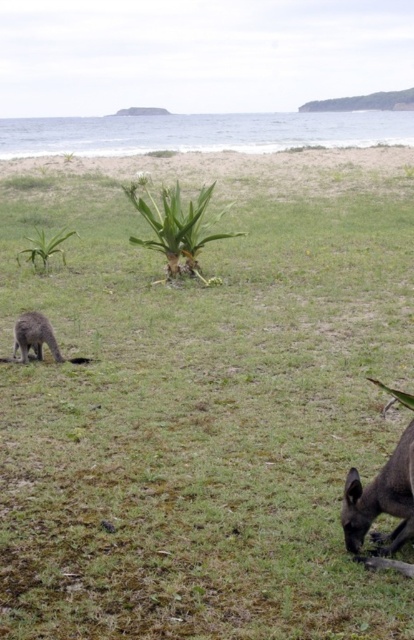
Question: From the image, what is the correct spatial relationship of brown furry kangaroo at lower right in relation to brown fur kangaroo at lower left?

Choices:
 (A) above
 (B) below

Answer: (B)

Question: Is brown furry kangaroo at lower right to the right of brown fur kangaroo at lower left from the viewer's perspective?

Choices:
 (A) yes
 (B) no

Answer: (A)

Question: Does brown furry kangaroo at lower right have a lesser width compared to brown fur kangaroo at lower left?

Choices:
 (A) no
 (B) yes

Answer: (B)

Question: Which point appears closest to the camera in this image?

Choices:
 (A) click(19, 330)
 (B) click(361, 531)

Answer: (B)